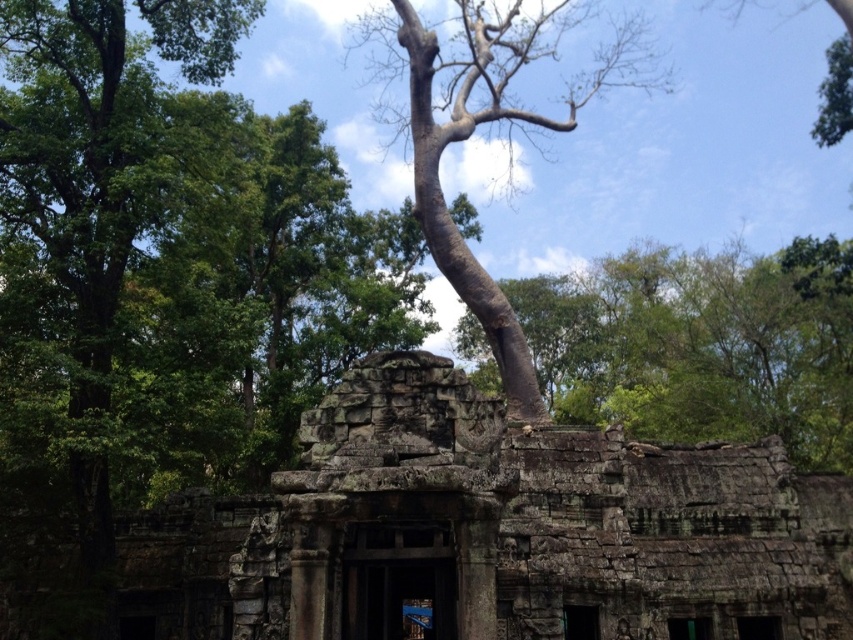
Can you confirm if weathered stone ruins at center is thinner than bark textured tree at center?

Yes.

Between weathered stone ruins at center and bark textured tree at center, which one has more height?

Standing taller between the two is bark textured tree at center.

Where is `weathered stone ruins at center`? weathered stone ruins at center is located at coordinates (532, 525).

Is brown rough tree trunk at center smaller than bark textured tree at center?

Indeed, brown rough tree trunk at center has a smaller size compared to bark textured tree at center.

In the scene shown: Measure the distance from brown rough tree trunk at center to bark textured tree at center.

34.42 meters

Identify the location of brown rough tree trunk at center. [701, 346].

Who is taller, weathered stone ruins at center or brown rough tree trunk at center?

brown rough tree trunk at center

This screenshot has width=853, height=640. Describe the element at coordinates (532, 525) in the screenshot. I see `weathered stone ruins at center` at that location.

What do you see at coordinates (532, 525) in the screenshot? I see `weathered stone ruins at center` at bounding box center [532, 525].

The width and height of the screenshot is (853, 640). Identify the location of weathered stone ruins at center. (532, 525).